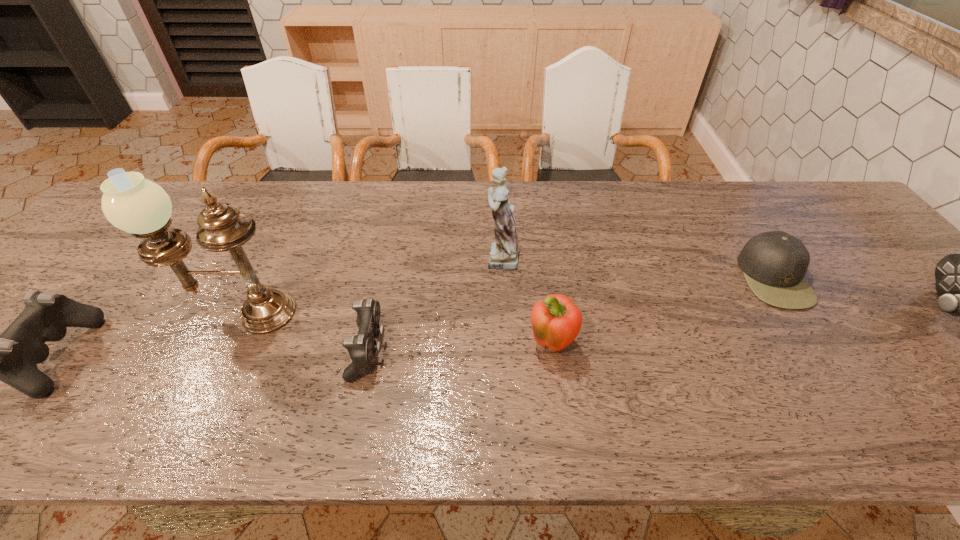
Locate an element on the screen. This screenshot has height=540, width=960. blank space that satisfies the following two spatial constraints: 1. on the front side of the oil lamp; 2. on the right side of the pepper is located at coordinates click(x=226, y=346).